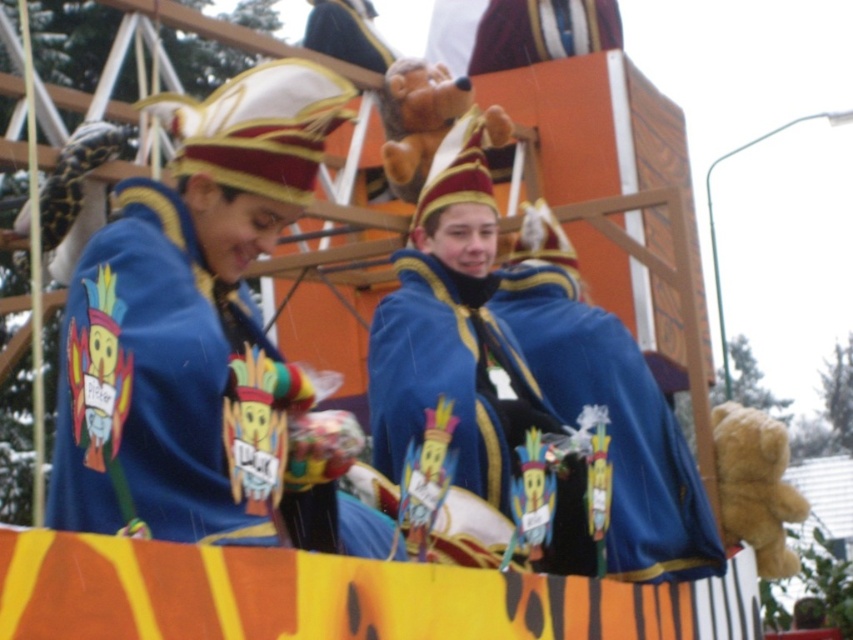
You are a photographer standing at the base of the float. You want to take a photo of both the blue velvet cape at center and the matte blue cape at center without zooming in. Given that your camera has a maximum focus range of 8 meters, will you be able to capture both capes clearly in the same frame?

The blue velvet cape at center is 8.96 meters away from the matte blue cape at center. Since the distance between them exceeds the camera maximum focus range of 8 meters, you won wait be able to capture both capes clearly in the same frame without zooming in.

You are a photographer standing at the edge of the parade route. You need to capture a photo of the blue velvet cape at center. Where should you position your camera to ensure it is in the frame?

Position your camera so that it is aimed at the coordinates point [199,333] where the blue velvet cape at center is located.